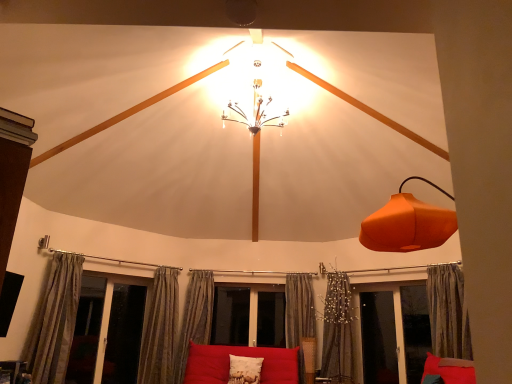
Question: From a real-world perspective, is matte red couch at center located beneath orange matte lampshade at right?

Choices:
 (A) no
 (B) yes

Answer: (B)

Question: From a real-world perspective, is matte red couch at center positioned over orange matte lampshade at right based on gravity?

Choices:
 (A) no
 (B) yes

Answer: (A)

Question: Is matte red couch at center taller than orange matte lampshade at right?

Choices:
 (A) yes
 (B) no

Answer: (B)

Question: Are matte red couch at center and orange matte lampshade at right making contact?

Choices:
 (A) no
 (B) yes

Answer: (A)

Question: Considering the relative sizes of matte red couch at center and orange matte lampshade at right in the image provided, is matte red couch at center shorter than orange matte lampshade at right?

Choices:
 (A) yes
 (B) no

Answer: (A)

Question: In the image, is textured beige curtain at lower center, marked as the 4th curtain in a right-to-left arrangement, positioned in front of or behind textured beige curtain at left, the 6th curtain when ordered from right to left?

Choices:
 (A) behind
 (B) front

Answer: (A)

Question: From the image's perspective, is textured beige curtain at lower center, placed as the third curtain when sorted from left to right, located above or below textured beige curtain at left, the 6th curtain when ordered from right to left?

Choices:
 (A) above
 (B) below

Answer: (B)

Question: Based on their sizes in the image, would you say textured beige curtain at lower center, placed as the third curtain when sorted from left to right, is bigger or smaller than textured beige curtain at left, positioned as the first curtain in left-to-right order?

Choices:
 (A) big
 (B) small

Answer: (B)

Question: Considering the positions of textured beige curtain at lower center, marked as the 4th curtain in a right-to-left arrangement, and textured beige curtain at left, positioned as the first curtain in left-to-right order, in the image, is textured beige curtain at lower center, marked as the 4th curtain in a right-to-left arrangement, taller or shorter than textured beige curtain at left, positioned as the first curtain in left-to-right order,?

Choices:
 (A) short
 (B) tall

Answer: (B)

Question: From the image's perspective, is transparent glass screen door at lower left, arranged as the 1th screen door when viewed from the left, located above or below white textured pillow at center?

Choices:
 (A) below
 (B) above

Answer: (B)

Question: Considering the positions of transparent glass screen door at lower left, arranged as the 1th screen door when viewed from the left, and white textured pillow at center in the image, is transparent glass screen door at lower left, arranged as the 1th screen door when viewed from the left, taller or shorter than white textured pillow at center?

Choices:
 (A) short
 (B) tall

Answer: (B)

Question: Is transparent glass screen door at lower left, arranged as the 1th screen door when viewed from the left, in front of or behind white textured pillow at center in the image?

Choices:
 (A) behind
 (B) front

Answer: (A)

Question: Is point (121, 342) positioned closer to the camera than point (230, 354)?

Choices:
 (A) farther
 (B) closer

Answer: (B)

Question: Visually, is textured beige curtain at left, positioned as the first curtain in left-to-right order, positioned to the left or to the right of white textured pillow at center?

Choices:
 (A) left
 (B) right

Answer: (A)

Question: In the image, is textured beige curtain at left, the 6th curtain when ordered from right to left, positioned in front of or behind white textured pillow at center?

Choices:
 (A) behind
 (B) front

Answer: (B)